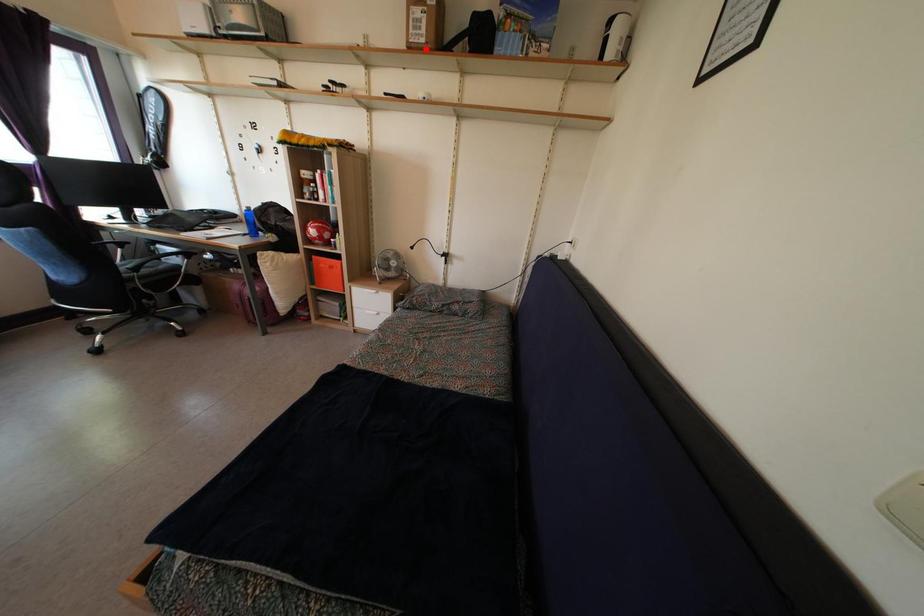
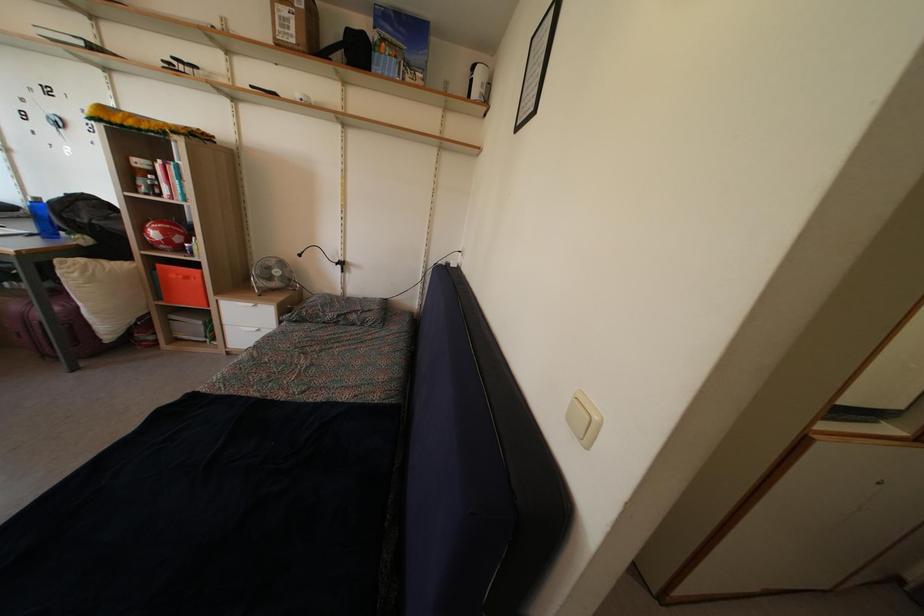
Question: I am providing you with two images of the same scene from different viewpoints. A red point is marked on the first image. Is the red point's position out of view in image 2?

Choices:
 (A) Yes
 (B) No

Answer: (B)